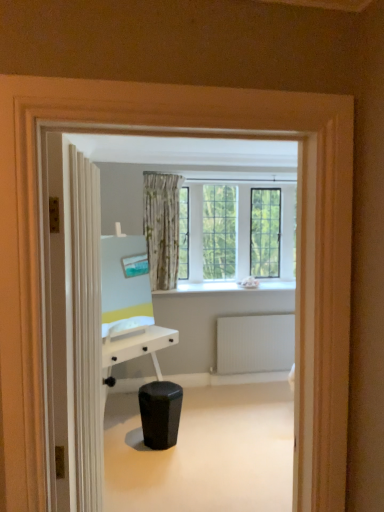
Question: Does white matte radiator at lower right appear on the left side of white textured door at left?

Choices:
 (A) yes
 (B) no

Answer: (B)

Question: From a real-world perspective, is white matte radiator at lower right located higher than white textured door at left?

Choices:
 (A) no
 (B) yes

Answer: (A)

Question: Is white matte radiator at lower right taller than white textured door at left?

Choices:
 (A) yes
 (B) no

Answer: (B)

Question: Does white matte radiator at lower right touch white textured door at left?

Choices:
 (A) yes
 (B) no

Answer: (B)

Question: From the image's perspective, is white matte radiator at lower right beneath white textured door at left?

Choices:
 (A) no
 (B) yes

Answer: (B)

Question: Is white matte radiator at lower right positioned before white textured door at left?

Choices:
 (A) yes
 (B) no

Answer: (B)

Question: Does white smooth window sill at center appear on the left side of white textured door at left?

Choices:
 (A) yes
 (B) no

Answer: (B)

Question: Is white smooth window sill at center positioned beyond the bounds of white textured door at left?

Choices:
 (A) no
 (B) yes

Answer: (B)

Question: Does white smooth window sill at center have a lesser width compared to white textured door at left?

Choices:
 (A) yes
 (B) no

Answer: (B)

Question: Is white smooth window sill at center bigger than white textured door at left?

Choices:
 (A) no
 (B) yes

Answer: (A)

Question: From a real-world perspective, is white smooth window sill at center on white textured door at left?

Choices:
 (A) yes
 (B) no

Answer: (B)

Question: Considering the relative positions of white smooth window sill at center and white textured door at left in the image provided, is white smooth window sill at center to the right of white textured door at left from the viewer's perspective?

Choices:
 (A) yes
 (B) no

Answer: (A)

Question: Is black matte music stool at center aimed at white smooth window sill at center?

Choices:
 (A) no
 (B) yes

Answer: (A)